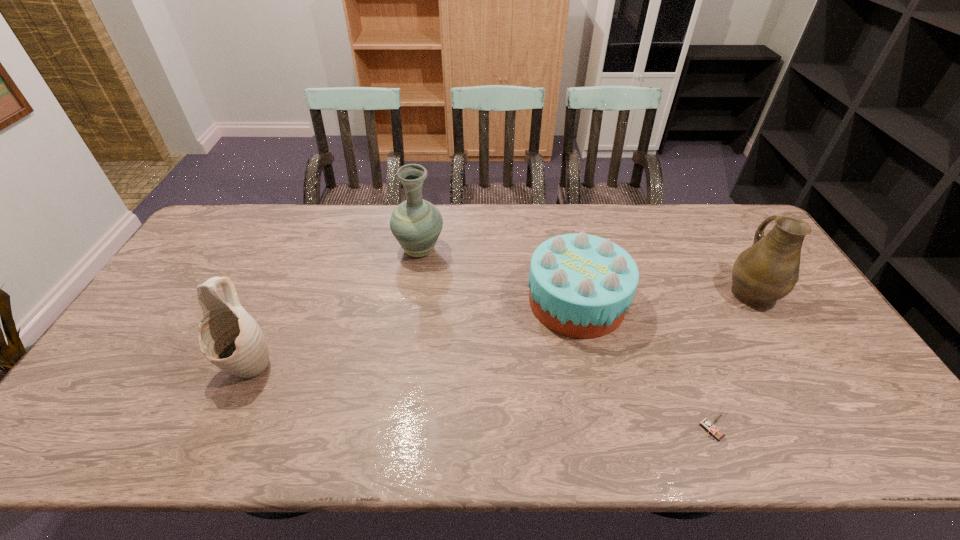
Locate which pitcher ranks third in proximity to the matchbox. Please provide its 2D coordinates. Your answer should be formatted as a tuple, i.e. [(x, y)], where the tuple contains the x and y coordinates of a point satisfying the conditions above.

[(231, 339)]

Where is `blank area in the image that satisfies the following two spatial constraints: 1. at the spout of the shortest object; 2. on the right side of the nearest pitcher`? The width and height of the screenshot is (960, 540). blank area in the image that satisfies the following two spatial constraints: 1. at the spout of the shortest object; 2. on the right side of the nearest pitcher is located at coordinates (221, 430).

The height and width of the screenshot is (540, 960). Find the location of `free space that satisfies the following two spatial constraints: 1. on the front side of the nearest object; 2. on the right side of the cake`. free space that satisfies the following two spatial constraints: 1. on the front side of the nearest object; 2. on the right side of the cake is located at coordinates click(x=604, y=430).